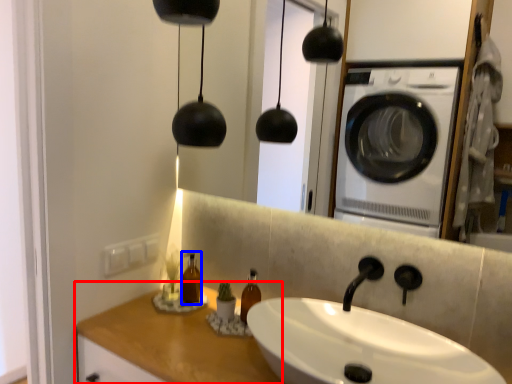
Question: Which object appears farthest to the camera in this image, counter top (highlighted by a red box) or bottle (highlighted by a blue box)?

Choices:
 (A) counter top
 (B) bottle

Answer: (B)